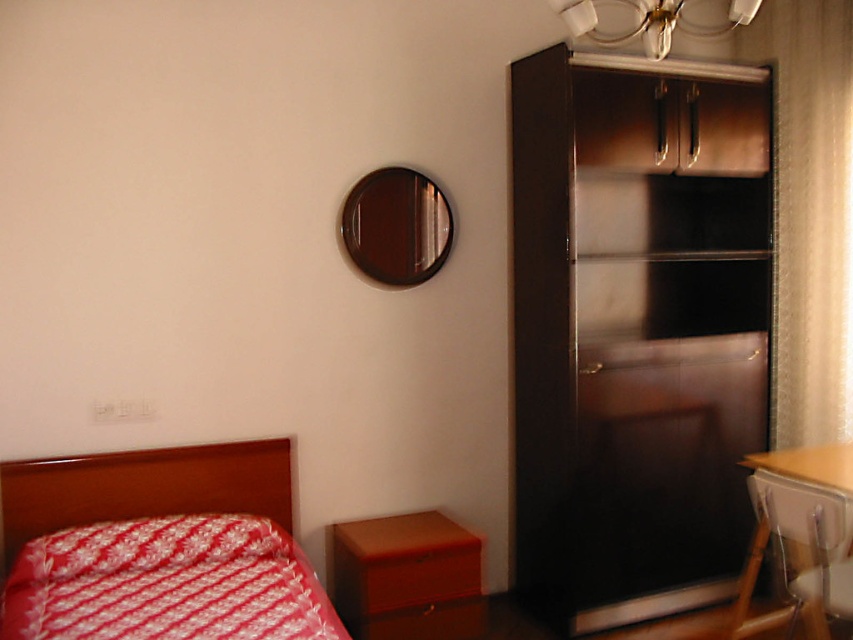
You are standing in the room and want to hang a picture frame that is 1 meter wide on the wall. The picture frame must be placed exactly where the point at point (x=671, y=330) is located. Is there enough space to hang the picture frame at that spot without overlapping any existing objects?

The point (x=671, y=330) is 3.58 meters away from the viewer. Since the picture frame is 1 meter wide, there is sufficient space to hang it at that location without overlapping any existing objects.

In the scene shown: You are standing in the room and want to determine which of the two points, point (805, 19) or point (364, 573), is closer to you. Based on the scene, which point is nearer?

Point (805, 19) is further to the viewer than point (364, 573), so the closer point is point (364, 573).

You are planning to move a large piece of furniture into the room. You have a choice between placing it near the black glossy cabinet at right or the metallic brass chandelier at upper center. Based on their sizes, which location would you choose to ensure the new furniture fits better?

The black glossy cabinet at right is larger in size than the metallic brass chandelier at upper center, so placing the new furniture near the black glossy cabinet at right would be more suitable as there is more space available.